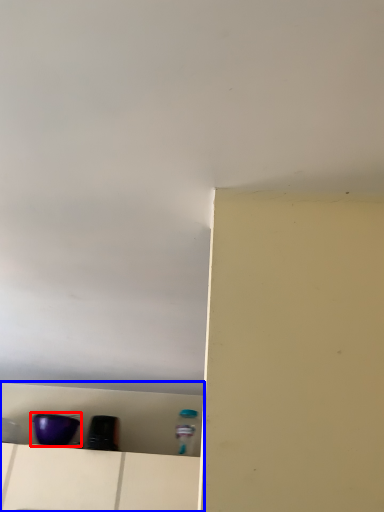
Question: Which of the following is the closest to the observer, appliance (highlighted by a red box) or shelf (highlighted by a blue box)?

Choices:
 (A) appliance
 (B) shelf

Answer: (B)